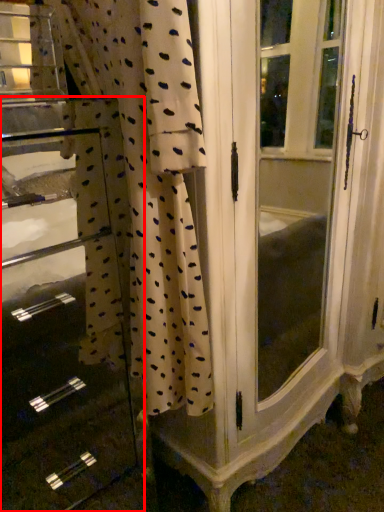
Question: From the image's perspective, where is file cabinet (annotated by the red box) located relative to curtain?

Choices:
 (A) below
 (B) above

Answer: (A)